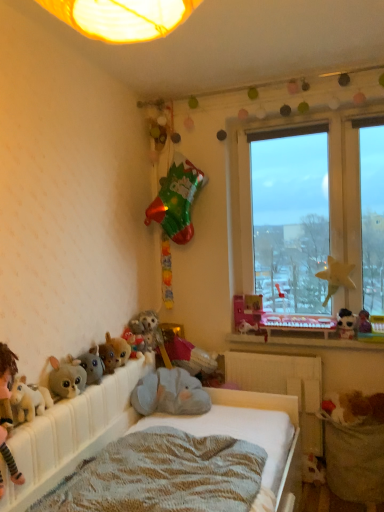
Question: From the image's perspective, would you say pink matte book at window, positioned as the 1th toy in right-to-left order, is positioned over fluffy plush toys at lower left, placed as the second toy when sorted from left to right?

Choices:
 (A) no
 (B) yes

Answer: (B)

Question: Can you confirm if pink matte book at window, positioned as the eighth toy in left-to-right order, is shorter than fluffy plush toys at lower left, the seventh toy viewed from the right?

Choices:
 (A) yes
 (B) no

Answer: (B)

Question: Is pink matte book at window, positioned as the 1th toy in right-to-left order, smaller than fluffy plush toys at lower left, the seventh toy viewed from the right?

Choices:
 (A) no
 (B) yes

Answer: (A)

Question: Can you confirm if pink matte book at window, positioned as the eighth toy in left-to-right order, is positioned to the right of fluffy plush toys at lower left, placed as the second toy when sorted from left to right?

Choices:
 (A) no
 (B) yes

Answer: (B)

Question: Is pink matte book at window, positioned as the 1th toy in right-to-left order, touching fluffy plush toys at lower left, the seventh toy viewed from the right?

Choices:
 (A) yes
 (B) no

Answer: (B)

Question: From a real-world perspective, is pink matte book at window, positioned as the 1th toy in right-to-left order, positioned over fluffy plush toys at lower left, the seventh toy viewed from the right, based on gravity?

Choices:
 (A) yes
 (B) no

Answer: (A)

Question: Does fluffy plush toys at lower left, placed as the second toy when sorted from left to right, have a larger size compared to fluffy plush toy at lower left, which is the 6th toy in right-to-left order?

Choices:
 (A) no
 (B) yes

Answer: (B)

Question: Can you confirm if fluffy plush toys at lower left, placed as the second toy when sorted from left to right, is shorter than fluffy plush toy at lower left, which appears as the 3th toy when viewed from the left?

Choices:
 (A) yes
 (B) no

Answer: (A)

Question: Is fluffy plush toys at lower left, placed as the second toy when sorted from left to right, thinner than fluffy plush toy at lower left, which is the 6th toy in right-to-left order?

Choices:
 (A) no
 (B) yes

Answer: (A)

Question: Is fluffy plush toys at lower left, the seventh toy viewed from the right, to the left of fluffy plush toy at lower left, which is the 6th toy in right-to-left order, from the viewer's perspective?

Choices:
 (A) yes
 (B) no

Answer: (A)

Question: Can you confirm if fluffy plush toys at lower left, placed as the second toy when sorted from left to right, is wider than fluffy plush toy at lower left, which appears as the 3th toy when viewed from the left?

Choices:
 (A) no
 (B) yes

Answer: (B)

Question: Would you say fluffy plush toys at lower left, the seventh toy viewed from the right, is outside fluffy plush toy at lower left, which appears as the 3th toy when viewed from the left?

Choices:
 (A) yes
 (B) no

Answer: (A)

Question: Considering the relative sizes of fluffy plush toy at lower left, acting as the 8th toy starting from the right, and wooden at lower right in the image provided, is fluffy plush toy at lower left, acting as the 8th toy starting from the right, bigger than wooden at lower right?

Choices:
 (A) yes
 (B) no

Answer: (B)